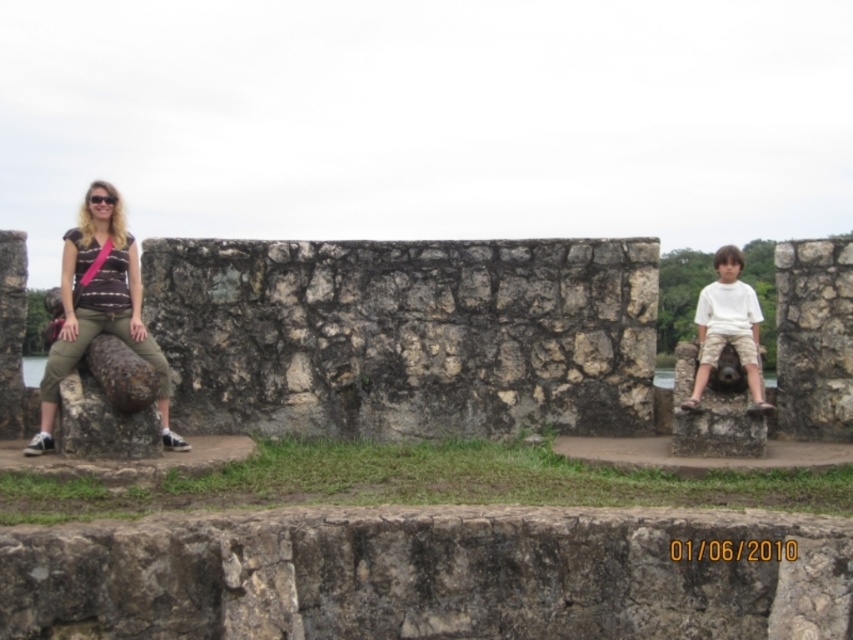
Question: Is matte black shirt at left above white cotton shirt at right?

Choices:
 (A) yes
 (B) no

Answer: (A)

Question: Does matte black shirt at left have a lesser width compared to white cotton shirt at right?

Choices:
 (A) no
 (B) yes

Answer: (A)

Question: Which object is closer to the camera taking this photo?

Choices:
 (A) white cotton shirt at right
 (B) matte black shirt at left

Answer: (B)

Question: Which object is farther from the camera taking this photo?

Choices:
 (A) white cotton shirt at right
 (B) matte black shirt at left

Answer: (A)

Question: From the image, what is the correct spatial relationship of matte black shirt at left in relation to white cotton shirt at right?

Choices:
 (A) right
 (B) left

Answer: (B)